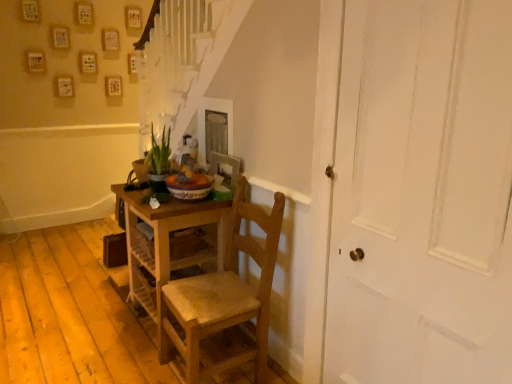
Question: From a real-world perspective, is white painted wood door at right located higher than wooden picture frame at center?

Choices:
 (A) no
 (B) yes

Answer: (A)

Question: Is white painted wood door at right behind wooden picture frame at center?

Choices:
 (A) no
 (B) yes

Answer: (A)

Question: Is white painted wood door at right thinner than wooden picture frame at center?

Choices:
 (A) no
 (B) yes

Answer: (A)

Question: Considering the relative sizes of white painted wood door at right and wooden picture frame at center in the image provided, is white painted wood door at right bigger than wooden picture frame at center?

Choices:
 (A) yes
 (B) no

Answer: (A)

Question: Does white painted wood door at right appear on the left side of wooden picture frame at center?

Choices:
 (A) no
 (B) yes

Answer: (A)

Question: Considering the relative sizes of white painted wood door at right and wooden picture frame at center in the image provided, is white painted wood door at right shorter than wooden picture frame at center?

Choices:
 (A) yes
 (B) no

Answer: (B)

Question: Is green glossy plant at center positioned far away from wooden desk at center?

Choices:
 (A) no
 (B) yes

Answer: (A)

Question: Can you confirm if green glossy plant at center is positioned to the right of wooden desk at center?

Choices:
 (A) yes
 (B) no

Answer: (B)

Question: Can you confirm if green glossy plant at center is positioned to the left of wooden desk at center?

Choices:
 (A) yes
 (B) no

Answer: (A)

Question: Is green glossy plant at center facing towards wooden desk at center?

Choices:
 (A) no
 (B) yes

Answer: (A)

Question: Is green glossy plant at center positioned in front of wooden desk at center?

Choices:
 (A) yes
 (B) no

Answer: (B)

Question: From the image's perspective, is green glossy plant at center on top of wooden desk at center?

Choices:
 (A) no
 (B) yes

Answer: (B)

Question: From the image's perspective, is wooden chair at center on white painted wood door at right?

Choices:
 (A) yes
 (B) no

Answer: (B)